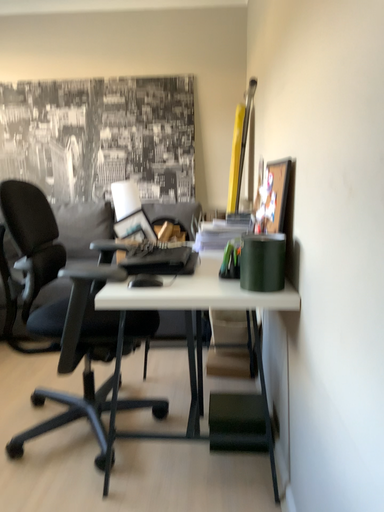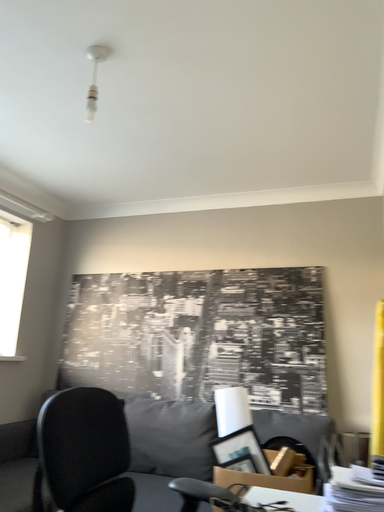
Question: How did the camera likely rotate when shooting the video?

Choices:
 (A) rotated right
 (B) rotated left

Answer: (B)